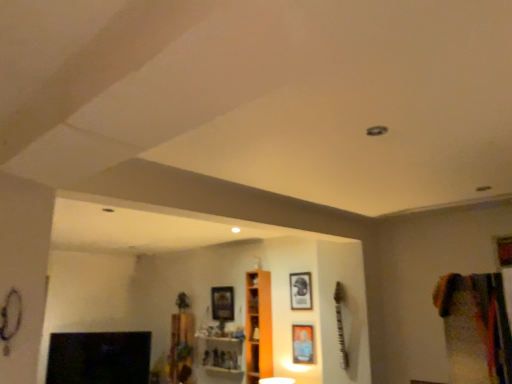
Image resolution: width=512 pixels, height=384 pixels. Identify the location of multicolored fabric at right. (475, 328).

Find the location of `wooden picture frame at center, the 1th picture frame positioned from the back`. wooden picture frame at center, the 1th picture frame positioned from the back is located at coordinates (222, 303).

The height and width of the screenshot is (384, 512). I want to click on orange wood cabinet at center, so click(258, 326).

What do you see at coordinates (303, 344) in the screenshot? The image size is (512, 384). I see `metallic silver picture frame at center, positioned as the second picture frame in right-to-left order` at bounding box center [303, 344].

In order to face wooden shelf at center, the 2th shelf from the right, should I rotate leftwards or rightwards?

You should look left and rotate roughly 9.701 degrees.

The image size is (512, 384). Find the location of `wooden shelf at center, placed as the second shelf when sorted from left to right`. wooden shelf at center, placed as the second shelf when sorted from left to right is located at coordinates (219, 353).

Does point (267, 296) appear closer or farther from the camera than point (220, 363)?

Point (267, 296) is closer to the camera than point (220, 363).

The image size is (512, 384). I want to click on cabinet in front of the wooden shelf at center, arranged as the first shelf when viewed from the right, so click(258, 326).

Based on their positions, is orange wood cabinet at center located to the left or right of wooden shelf at center, placed as the second shelf when sorted from left to right?

In the image, orange wood cabinet at center appears on the right side of wooden shelf at center, placed as the second shelf when sorted from left to right.

Locate an element on the screen. This screenshot has height=384, width=512. cabinet below the wooden picture frame at center, arranged as the 3th picture frame when viewed from the right (from a real-world perspective) is located at coordinates (258, 326).

Does point (264, 317) come in front of point (213, 297)?

Yes.

Considering the positions of objects orange wood cabinet at center and wooden picture frame at center, arranged as the 3th picture frame when viewed from the right, in the image provided, who is behind, orange wood cabinet at center or wooden picture frame at center, arranged as the 3th picture frame when viewed from the right,?

wooden picture frame at center, arranged as the 3th picture frame when viewed from the right, is further from the camera.

In the scene shown: Considering the sizes of objects wooden shelf at center, the 2th shelf from the right, and wooden picture frame at center, which is counted as the first picture frame, starting from the left, in the image provided, who is wider, wooden shelf at center, the 2th shelf from the right, or wooden picture frame at center, which is counted as the first picture frame, starting from the left,?

wooden shelf at center, the 2th shelf from the right.

Considering the positions of objects wooden shelf at center, acting as the first shelf starting from the left, and wooden picture frame at center, which is counted as the first picture frame, starting from the left, in the image provided, who is more to the right, wooden shelf at center, acting as the first shelf starting from the left, or wooden picture frame at center, which is counted as the first picture frame, starting from the left,?

Positioned to the right is wooden picture frame at center, which is counted as the first picture frame, starting from the left.

Is wooden shelf at center, acting as the first shelf starting from the left, with wooden picture frame at center, the 3th picture frame in the front-to-back sequence?

No.

Which is correct: wooden shelf at center, arranged as the first shelf when viewed from the right, is inside matte black picture frame at center, the 2th picture frame positioned from the front, or outside of it?

wooden shelf at center, arranged as the first shelf when viewed from the right, lies outside matte black picture frame at center, the 2th picture frame positioned from the front.

Can you confirm if wooden shelf at center, placed as the second shelf when sorted from left to right, is shorter than matte black picture frame at center, the 2th picture frame positioned from the front?

No.

From a real-world perspective, which is physically below, wooden shelf at center, placed as the second shelf when sorted from left to right, or matte black picture frame at center, acting as the second picture frame starting from the back?

wooden shelf at center, placed as the second shelf when sorted from left to right, from a real-world perspective.

Is wooden shelf at center, arranged as the first shelf when viewed from the right, to the left or to the right of matte black picture frame at center, which is the third picture frame from left to right, in the image?

From the image, it's evident that wooden shelf at center, arranged as the first shelf when viewed from the right, is to the left of matte black picture frame at center, which is the third picture frame from left to right.

Looking at the image, does orange wood cabinet at center seem bigger or smaller compared to wooden shelf at center, acting as the first shelf starting from the left?

In the image, orange wood cabinet at center appears to be larger than wooden shelf at center, acting as the first shelf starting from the left.

How different are the orientations of orange wood cabinet at center and wooden shelf at center, acting as the first shelf starting from the left, in degrees?

The angle between the facing direction of orange wood cabinet at center and the facing direction of wooden shelf at center, acting as the first shelf starting from the left, is 0.000521 degrees.

Is wooden shelf at center, the 2th shelf from the right, a part of orange wood cabinet at center?

That's incorrect, wooden shelf at center, the 2th shelf from the right, is not inside orange wood cabinet at center.

In terms of size, does wooden picture frame at center, the 3th picture frame in the front-to-back sequence, appear bigger or smaller than matte black picture frame at center, acting as the second picture frame starting from the back?

Clearly, wooden picture frame at center, the 3th picture frame in the front-to-back sequence, is larger in size than matte black picture frame at center, acting as the second picture frame starting from the back.

Looking at this image, would you say wooden picture frame at center, the 3th picture frame in the front-to-back sequence, contains matte black picture frame at center, the 2th picture frame positioned from the front?

No, wooden picture frame at center, the 3th picture frame in the front-to-back sequence, does not contain matte black picture frame at center, the 2th picture frame positioned from the front.

Where is `the 1st picture frame below the matte black picture frame at center, the 2th picture frame positioned from the front (from the image's perspective)`? Image resolution: width=512 pixels, height=384 pixels. the 1st picture frame below the matte black picture frame at center, the 2th picture frame positioned from the front (from the image's perspective) is located at coordinates (222, 303).

Can you see wooden picture frame at center, the 1th picture frame positioned from the back, touching orange wood cabinet at center?

No, wooden picture frame at center, the 1th picture frame positioned from the back, is not touching orange wood cabinet at center.

Between point (230, 300) and point (248, 346), which one is positioned behind?

Point (230, 300)

Would you say wooden picture frame at center, arranged as the 3th picture frame when viewed from the right, is inside or outside orange wood cabinet at center?

wooden picture frame at center, arranged as the 3th picture frame when viewed from the right, is located beyond the bounds of orange wood cabinet at center.

From a real-world perspective, which object rests below the other?

orange wood cabinet at center.

Locate an element on the screen. The width and height of the screenshot is (512, 384). the 1st shelf to the left of the orange wood cabinet at center, starting your count from the anchor is located at coordinates (219, 353).

This screenshot has width=512, height=384. In order to click on picture frame behind the orange wood cabinet at center in this screenshot , I will do `click(222, 303)`.

Considering their positions, is wooden picture frame at center, arranged as the 3th picture frame when viewed from the right, positioned further to wooden shelf at center, placed as the second shelf when sorted from left to right, than black glossy fireplace at lower left?

Among the two, black glossy fireplace at lower left is located further to wooden shelf at center, placed as the second shelf when sorted from left to right.

Estimate the real-world distances between objects in this image. Which object is further from wooden shelf at center, placed as the second shelf when sorted from left to right, multicolored fabric at right or orange wood cabinet at center?

The object further to wooden shelf at center, placed as the second shelf when sorted from left to right, is multicolored fabric at right.

Based on the photo, which object lies further to the anchor point wooden shelf at center, acting as the first shelf starting from the left, orange wood cabinet at center or multicolored fabric at right?

The object further to wooden shelf at center, acting as the first shelf starting from the left, is multicolored fabric at right.

Considering their positions, is orange wood cabinet at center positioned further to black glossy fireplace at lower left than wooden picture frame at center, the 3th picture frame in the front-to-back sequence?

Among the two, orange wood cabinet at center is located further to black glossy fireplace at lower left.

From the image, which object appears to be farther from matte black picture frame at center, the first picture frame from the right, multicolored fabric at right or orange wood cabinet at center?

multicolored fabric at right.

Looking at the image, which one is located closer to matte black picture frame at center, the 2th picture frame positioned from the front, black glossy fireplace at lower left or wooden shelf at center, acting as the first shelf starting from the left?

wooden shelf at center, acting as the first shelf starting from the left, is closer to matte black picture frame at center, the 2th picture frame positioned from the front.

When comparing their distances from orange wood cabinet at center, does multicolored fabric at right or black glossy fireplace at lower left seem closer?

The object closer to orange wood cabinet at center is black glossy fireplace at lower left.

Considering their positions, is matte black picture frame at center, the first picture frame from the right, positioned further to orange wood cabinet at center than wooden shelf at center, placed as the second shelf when sorted from left to right?

wooden shelf at center, placed as the second shelf when sorted from left to right.

This screenshot has width=512, height=384. Identify the location of cabinet situated between wooden shelf at center, arranged as the first shelf when viewed from the right, and matte black picture frame at center, acting as the second picture frame starting from the back, from left to right. (258, 326).

The height and width of the screenshot is (384, 512). In order to click on shelf between wooden shelf at center, acting as the first shelf starting from the left, and orange wood cabinet at center in this screenshot , I will do `click(219, 353)`.

Where is `cabinet between multicolored fabric at right and wooden shelf at center, acting as the first shelf starting from the left, along the z-axis`? cabinet between multicolored fabric at right and wooden shelf at center, acting as the first shelf starting from the left, along the z-axis is located at coordinates (258, 326).

The height and width of the screenshot is (384, 512). Identify the location of cabinet between wooden picture frame at center, which is counted as the first picture frame, starting from the left, and matte black picture frame at center, which is the third picture frame from left to right. (258, 326).